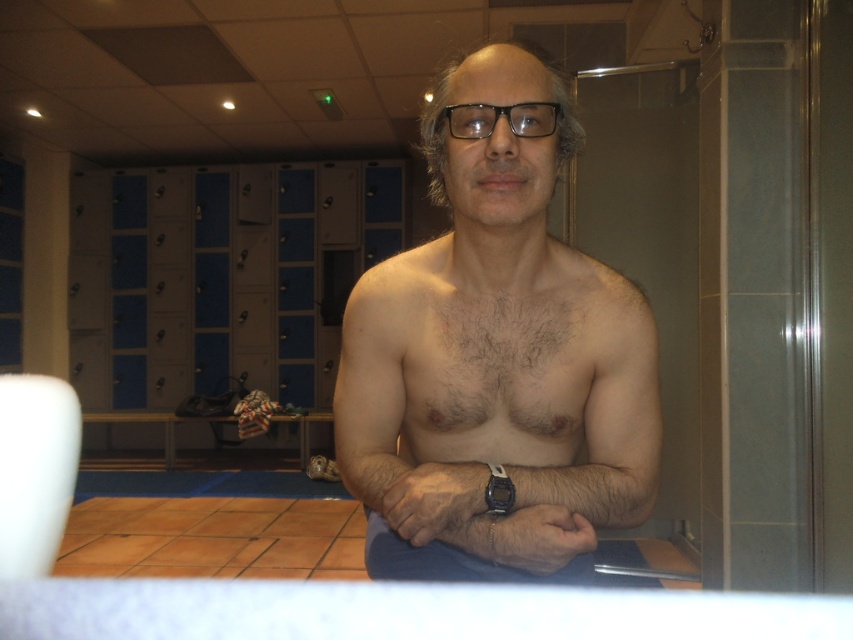
Based on the scene description, which area on the person is larger in size between the hairless skin at center and the hairy skin at center?

The hairless skin at center is larger in size than the hairy skin at center.